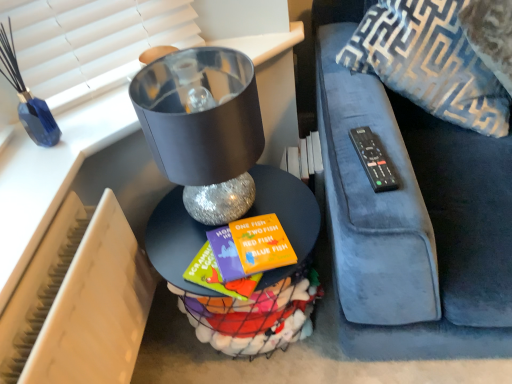
You are a GUI agent. You are given a task and a screenshot of the screen. Output one action in this format:
    pyautogui.click(x=<x>, y=<y>)
    Task: Click on the free location above metallic silver table at center (from a real-world perspective)
    
    Given the screenshot: What is the action you would take?
    pyautogui.click(x=243, y=216)